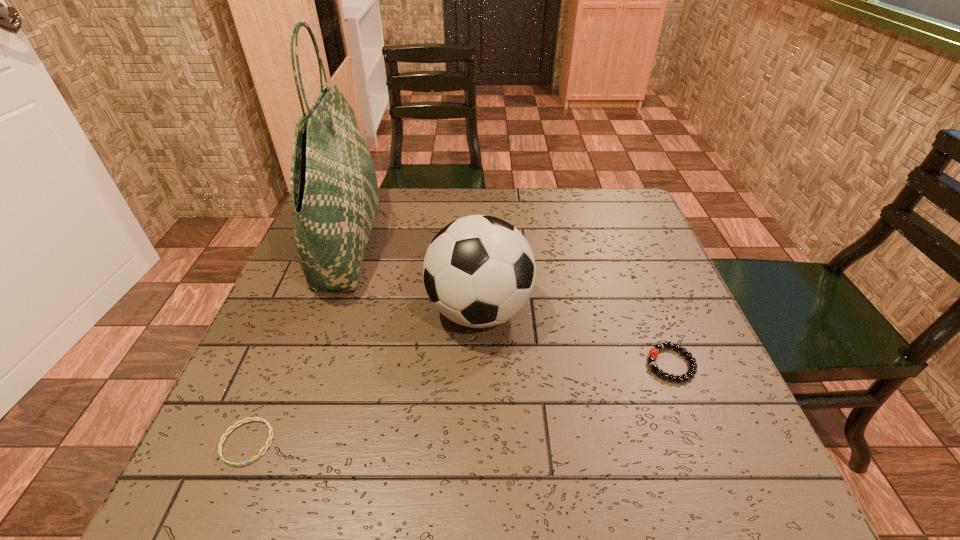
You are a GUI agent. You are given a task and a screenshot of the screen. Output one action in this format:
    pyautogui.click(x=<x>, y=<y>)
    Task: Click on the tote bag
    This screenshot has height=540, width=960.
    Given the screenshot: What is the action you would take?
    pyautogui.click(x=333, y=184)

This screenshot has width=960, height=540. What are the coordinates of `the third object from left to right` in the screenshot? It's located at (479, 271).

The width and height of the screenshot is (960, 540). In order to click on soccer ball in this screenshot , I will do `click(479, 271)`.

At what (x,y) coordinates should I click in order to perform the action: click on the right bracelet. Please return your answer as a coordinate pair (x, y). The width and height of the screenshot is (960, 540). Looking at the image, I should click on (653, 353).

Identify the location of the rightmost object. (653, 353).

Locate an element on the screen. The image size is (960, 540). the shortest object is located at coordinates (254, 418).

Find the location of a particular element. the left bracelet is located at coordinates (254, 418).

Locate an element on the screen. The height and width of the screenshot is (540, 960). free region located on the right of the tallest object is located at coordinates (503, 241).

Identify the location of vacant area situated on the back of the third object from left to right. Image resolution: width=960 pixels, height=540 pixels. (480, 212).

This screenshot has height=540, width=960. What are the coordinates of `free space located 0.370m on the left of the rightmost object` in the screenshot? It's located at (455, 364).